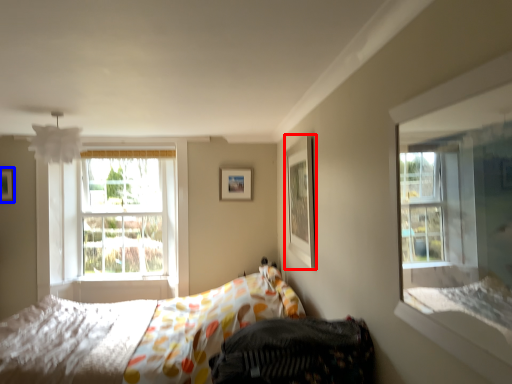
Question: Which object is further to the camera taking this photo, picture frame (highlighted by a red box) or picture frame (highlighted by a blue box)?

Choices:
 (A) picture frame
 (B) picture frame

Answer: (B)